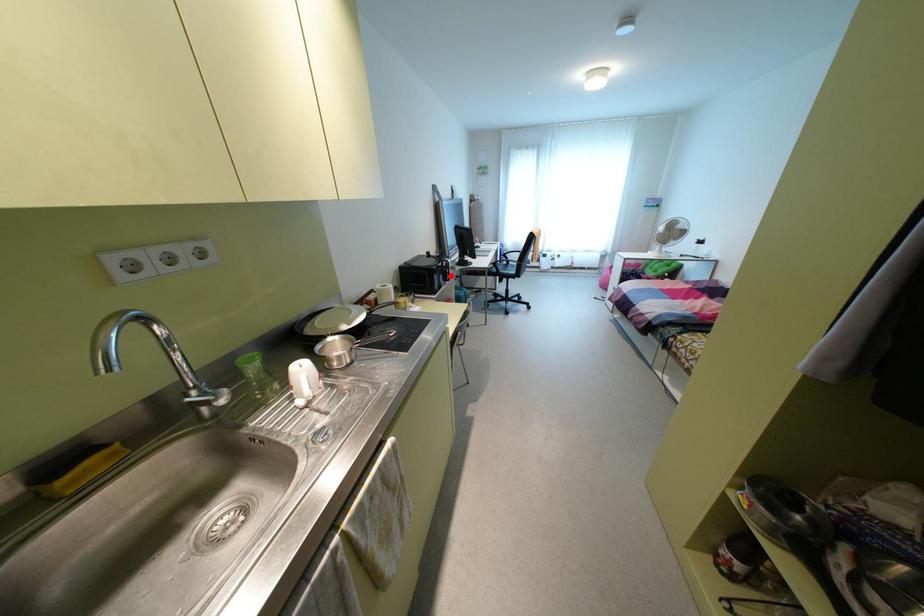
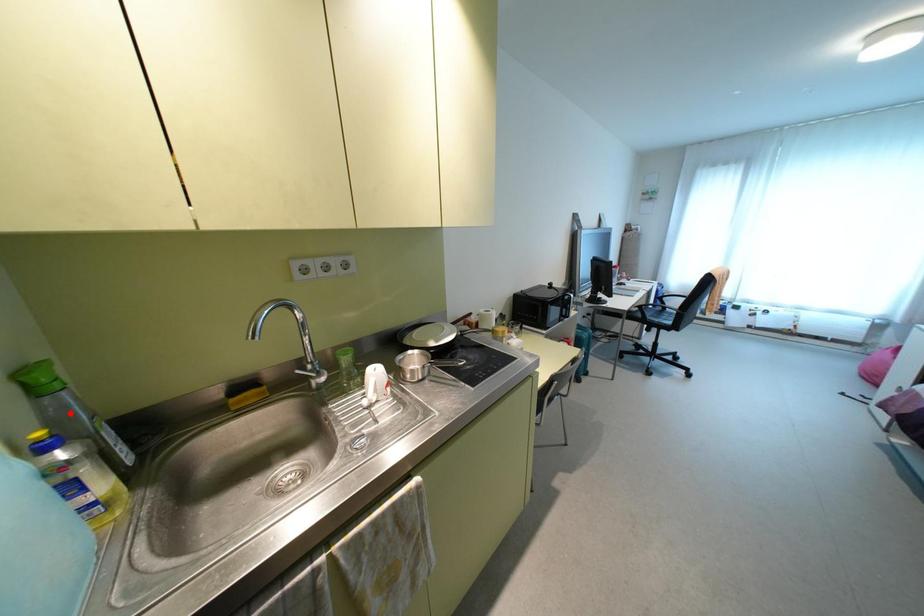
I am providing you with two images of the same scene from different viewpoints. A red point is marked on the first image and another point is marked on the second image. Are the points marked in image1 and image2 representing the same 3D position?

No